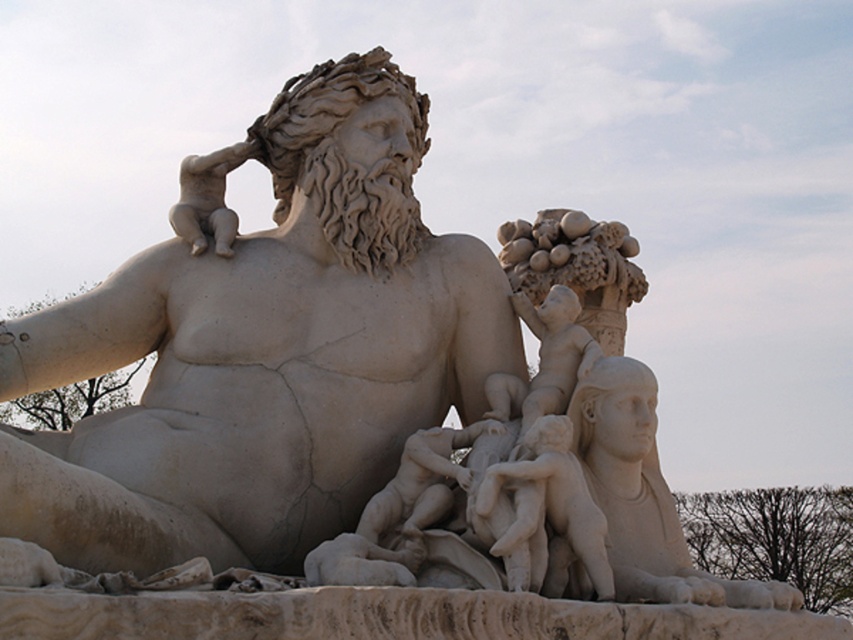
Question: Considering the relative positions of white marble statue at center and smooth white cherub at center in the image provided, where is white marble statue at center located with respect to smooth white cherub at center?

Choices:
 (A) below
 (B) above

Answer: (B)

Question: Which object appears farthest from the camera in this image?

Choices:
 (A) smooth white cherub at center
 (B) white marble statue at center

Answer: (A)

Question: Which object appears farthest from the camera in this image?

Choices:
 (A) white marble statue at center
 (B) smooth white cherub at center

Answer: (B)

Question: Among these points, which one is farthest from the camera?

Choices:
 (A) (42, 376)
 (B) (547, 436)

Answer: (A)

Question: Is white marble statue at center wider than smooth white cherub at center?

Choices:
 (A) yes
 (B) no

Answer: (A)

Question: In this image, where is white marble statue at center located relative to smooth white cherub at center?

Choices:
 (A) below
 (B) above

Answer: (B)